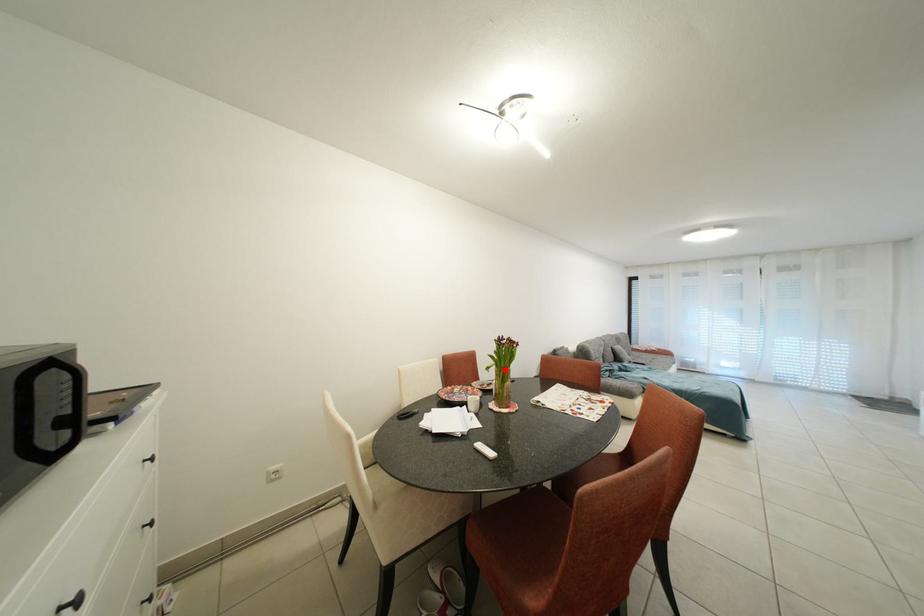
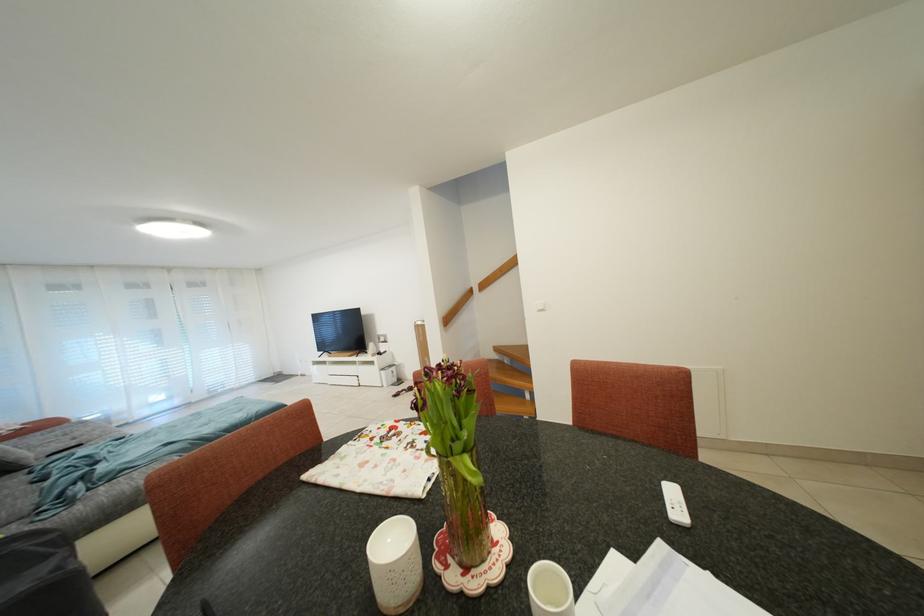
In the second image, find the point that corresponds to the highlighted location in the first image.

(472, 455)